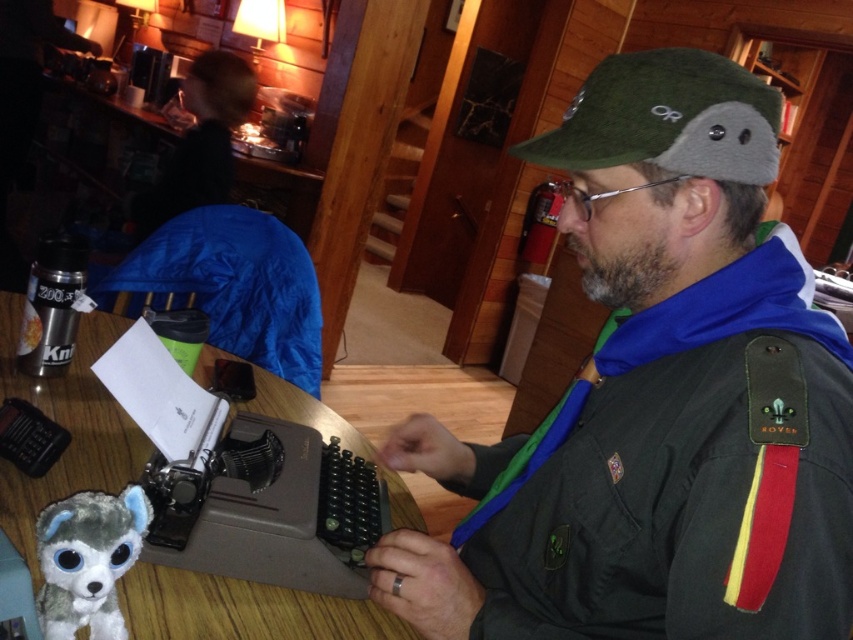
Who is more forward, (590, 356) or (25, 508)?

Positioned in front is point (25, 508).

The image size is (853, 640). Identify the location of green fabric cap at upper right. (656, 400).

Measure the distance between green fabric cap at upper right and camera.

They are 20.22 inches apart.

This screenshot has width=853, height=640. What are the coordinates of `green fabric cap at upper right` in the screenshot? It's located at (656, 400).

Who is positioned more to the left, green fabric cap at upper right or fuzzy plush toy at lower left?

fuzzy plush toy at lower left

Does green fabric cap at upper right appear on the right side of fuzzy plush toy at lower left?

Correct, you'll find green fabric cap at upper right to the right of fuzzy plush toy at lower left.

At what (x,y) coordinates should I click in order to perform the action: click on green fabric cap at upper right. Please return your answer as a coordinate pair (x, y). Looking at the image, I should click on (656, 400).

Which of these two, wooden table at center or fuzzy plush toy at lower left, stands taller?

wooden table at center is taller.

Describe the element at coordinates (67, 426) in the screenshot. I see `wooden table at center` at that location.

Which is in front, point (6, 323) or point (61, 593)?

Point (61, 593)

Identify the location of wooden table at center. (67, 426).